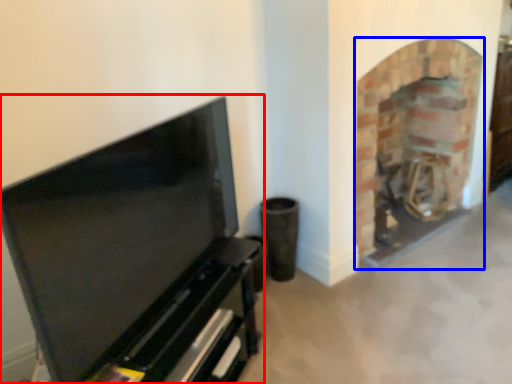
Question: Which of the following is the farthest to the observer, entertainment center (highlighted by a red box) or fireplace (highlighted by a blue box)?

Choices:
 (A) entertainment center
 (B) fireplace

Answer: (B)